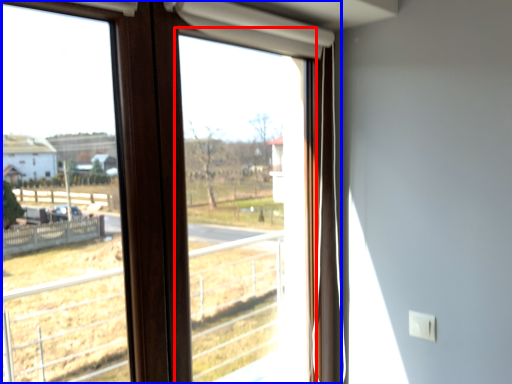
Question: Which point is closer to the camera, window screen (highlighted by a red box) or window (highlighted by a blue box)?

Choices:
 (A) window screen
 (B) window

Answer: (B)